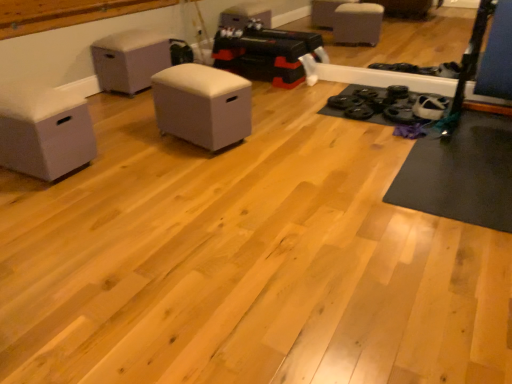
Question: From a real-world perspective, is white fabric ottoman at center, which is counted as the first furniture, starting from the right, located higher than white fabric ottoman at center, positioned as the 3th furniture in front-to-back order?

Choices:
 (A) yes
 (B) no

Answer: (B)

Question: From the image's perspective, is white fabric ottoman at center, placed as the third furniture when sorted from left to right, located beneath white fabric ottoman at center, positioned as the 3th furniture in front-to-back order?

Choices:
 (A) no
 (B) yes

Answer: (B)

Question: Is white fabric ottoman at center, which is counted as the second furniture, starting from the back, to the left of white fabric ottoman at center, positioned as the 3th furniture in front-to-back order, from the viewer's perspective?

Choices:
 (A) no
 (B) yes

Answer: (A)

Question: Considering the relative sizes of white fabric ottoman at center, marked as the 2th furniture in a front-to-back arrangement, and white fabric ottoman at center, positioned as the 3th furniture in front-to-back order, in the image provided, is white fabric ottoman at center, marked as the 2th furniture in a front-to-back arrangement, thinner than white fabric ottoman at center, positioned as the 3th furniture in front-to-back order,?

Choices:
 (A) yes
 (B) no

Answer: (A)

Question: Is white fabric ottoman at center, the second furniture positioned from the right, at the back of white fabric ottoman at center, which is counted as the first furniture, starting from the right?

Choices:
 (A) no
 (B) yes

Answer: (A)

Question: From the image's perspective, relative to white fabric ottoman at center, positioned as the second furniture in left-to-right order, is white fabric ottoman at center, placed as the third furniture when sorted from left to right, above or below?

Choices:
 (A) above
 (B) below

Answer: (B)

Question: From a real-world perspective, is white fabric ottoman at center, which is counted as the first furniture, starting from the right, physically located above or below white fabric ottoman at center, positioned as the second furniture in left-to-right order?

Choices:
 (A) above
 (B) below

Answer: (B)

Question: From their relative heights in the image, would you say white fabric ottoman at center, which is counted as the first furniture, starting from the right, is taller or shorter than white fabric ottoman at center, the second furniture positioned from the right?

Choices:
 (A) tall
 (B) short

Answer: (B)

Question: Is point (159, 96) closer or farther from the camera than point (144, 52)?

Choices:
 (A) closer
 (B) farther

Answer: (A)

Question: Would you say white fabric ottoman at center, positioned as the 3th furniture in front-to-back order, is inside or outside white fabric ottoman at center, which is counted as the first furniture, starting from the right?

Choices:
 (A) outside
 (B) inside

Answer: (A)

Question: Is white fabric ottoman at center, the second furniture positioned from the right, to the left or to the right of white fabric ottoman at center, marked as the 2th furniture in a front-to-back arrangement, in the image?

Choices:
 (A) left
 (B) right

Answer: (A)

Question: Is white fabric ottoman at center, acting as the 1th furniture starting from the back, wider or thinner than white fabric ottoman at center, which is counted as the first furniture, starting from the right?

Choices:
 (A) thin
 (B) wide

Answer: (B)

Question: From their relative heights in the image, would you say white fabric ottoman at center, the second furniture positioned from the right, is taller or shorter than white fabric ottoman at center, which is counted as the first furniture, starting from the right?

Choices:
 (A) short
 (B) tall

Answer: (B)

Question: Would you say white fabric ottoman at left, which ranks as the 1th furniture in front-to-back order, is to the left or to the right of white fabric ottoman at center, which is counted as the second furniture, starting from the back, in the picture?

Choices:
 (A) left
 (B) right

Answer: (A)

Question: Looking at the image, does white fabric ottoman at left, which ranks as the 1th furniture in front-to-back order, seem bigger or smaller compared to white fabric ottoman at center, which is counted as the second furniture, starting from the back?

Choices:
 (A) big
 (B) small

Answer: (B)